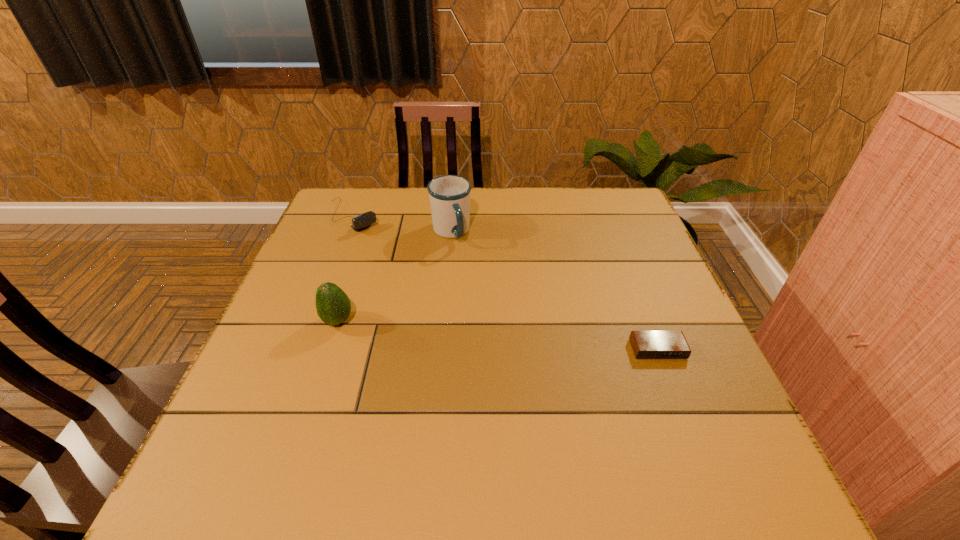
I want to click on free space on the desktop that is between the third shortest object and the nearest object and is positioned on the handle side of the mug, so click(x=516, y=337).

Find the location of `free spot on the desktop that is between the avocado and the alarm clock and is positioned on the front-facing side of the third tallest object`. free spot on the desktop that is between the avocado and the alarm clock and is positioned on the front-facing side of the third tallest object is located at coordinates (490, 334).